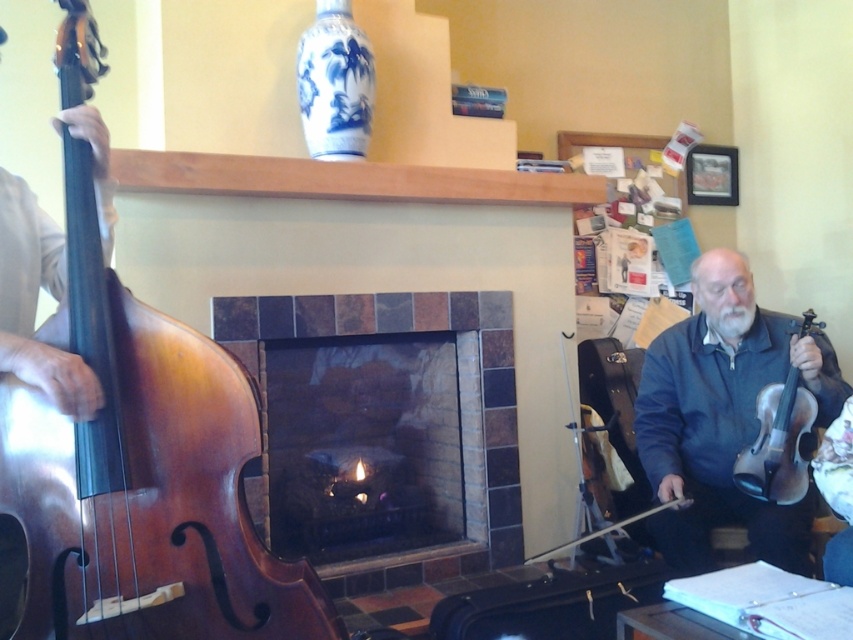
You are a guest at a house party and want to move from the shiny brown wood cello at left to the marble tiled fireplace at center. Which direction should you move towards?

You should move towards the right because the shiny brown wood cello at left is located to the left of the marble tiled fireplace at center, so moving right would bring you closer to the fireplace.

Based on the photo, you are a music teacher observing a performance. You notice two string instruments in the scene. Which one is larger in size between the shiny brown wood cello at left and the wooden violin at right?

The shiny brown wood cello at left is bigger than the wooden violin at right.

You are standing in the room and want to place a new decorative item on the mantelpiece. The mantelpiece is located at point 0.65. Where should you place the item so it is closer to the shiny brown wood cello at left?

The shiny brown wood cello at left is at point 0.702, so placing the item closer to 0.702 on the mantelpiece would make it nearer to the cello.